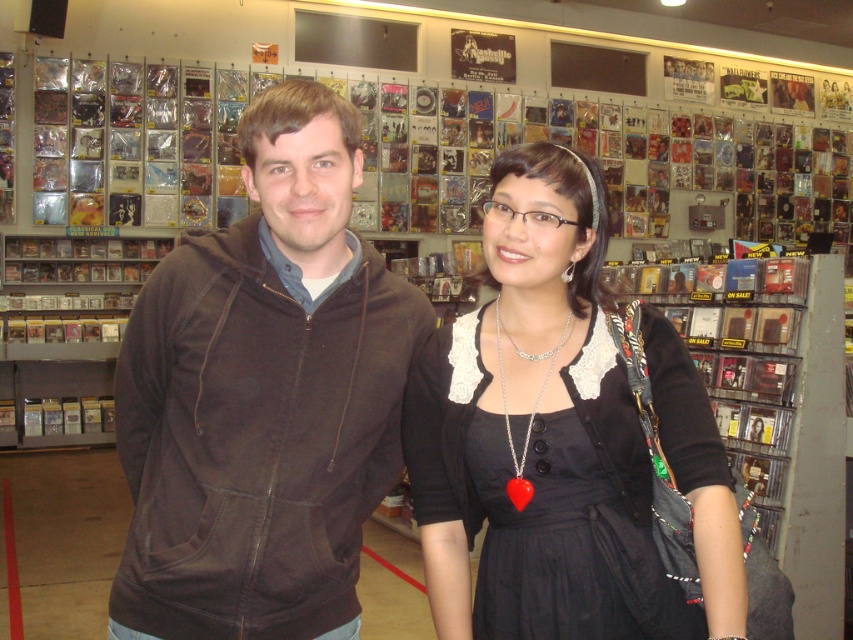
Question: From the image, what is the correct spatial relationship of brown cotton hoodie at left in relation to black lace dress at center?

Choices:
 (A) above
 (B) below

Answer: (A)

Question: Which point is farther to the camera?

Choices:
 (A) black lace dress at center
 (B) brown cotton hoodie at left

Answer: (B)

Question: Is brown cotton hoodie at left wider than black lace dress at center?

Choices:
 (A) yes
 (B) no

Answer: (A)

Question: Observing the image, what is the correct spatial positioning of brown cotton hoodie at left in reference to black lace dress at center?

Choices:
 (A) below
 (B) above

Answer: (B)

Question: Which point is farther to the camera?

Choices:
 (A) (221, 584)
 (B) (699, 406)

Answer: (A)